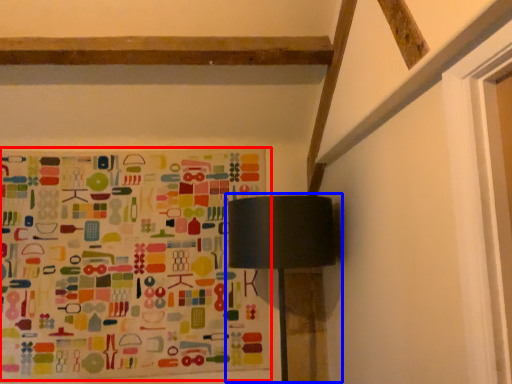
Question: Which of the following is the closest to the observer, bulletin board (highlighted by a red box) or table lamp (highlighted by a blue box)?

Choices:
 (A) bulletin board
 (B) table lamp

Answer: (B)